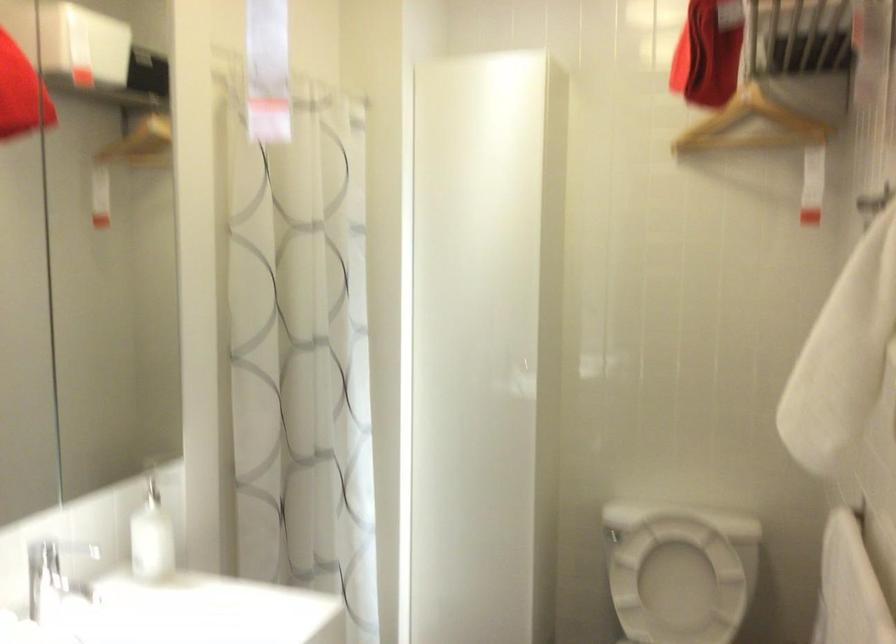
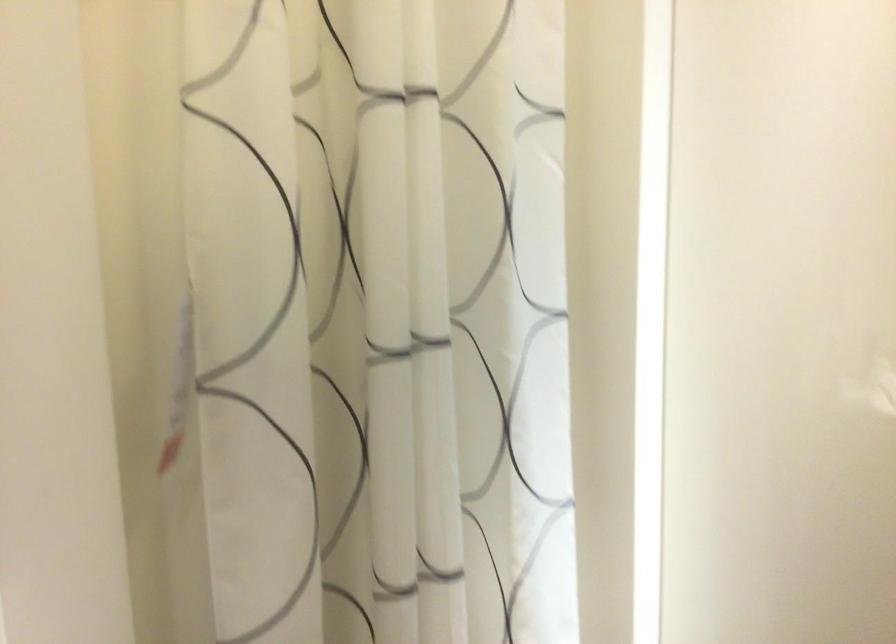
Question: Which direction would the cameraman need to move to produce the second image? Reply with the corresponding letter.

Choices:
 (A) Left
 (B) Right
 (C) Forward
 (D) Backward

Answer: (C)